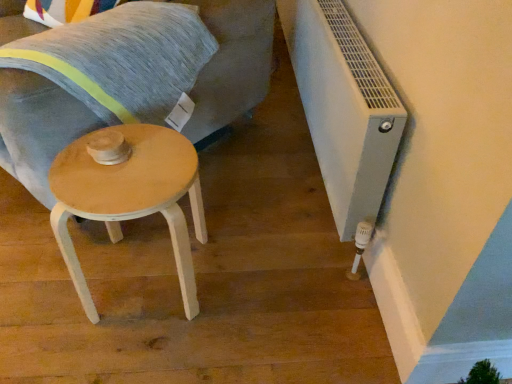
Question: From a real-world perspective, relative to white plastic radiator at lower right, is light wood/wooden stool at lower left vertically above or below?

Choices:
 (A) below
 (B) above

Answer: (A)

Question: Is light wood/wooden stool at lower left wider or thinner than white plastic radiator at lower right?

Choices:
 (A) thin
 (B) wide

Answer: (B)

Question: Considering the real-world distances, which object is closest to the light wood swivel chair at center?

Choices:
 (A) light wood/wooden stool at lower left
 (B) white plastic radiator at lower right
 (C) textured gray pillow at upper left

Answer: (C)

Question: Estimate the real-world distances between objects in this image. Which object is closer to the light wood swivel chair at center?

Choices:
 (A) textured gray pillow at upper left
 (B) light wood/wooden stool at lower left
 (C) white plastic radiator at lower right

Answer: (A)